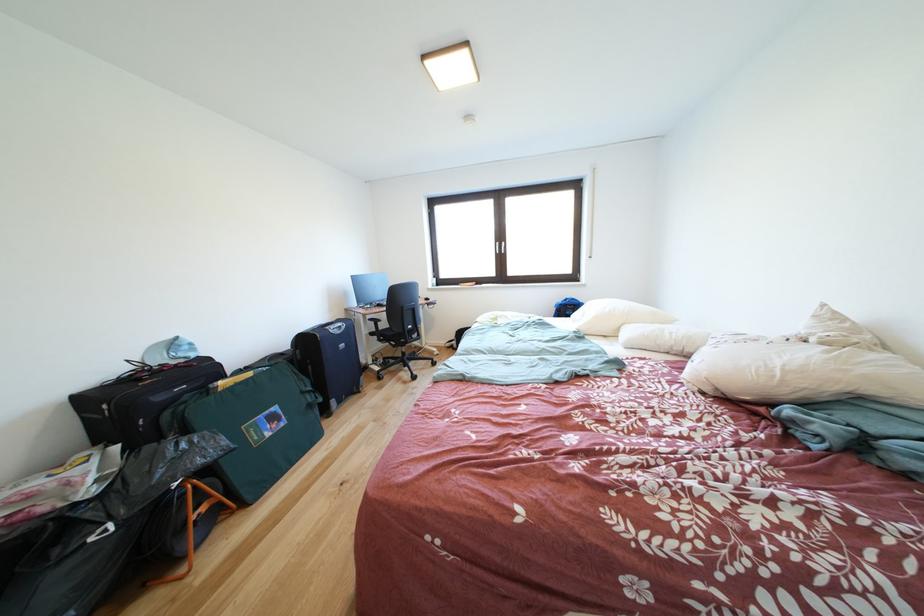
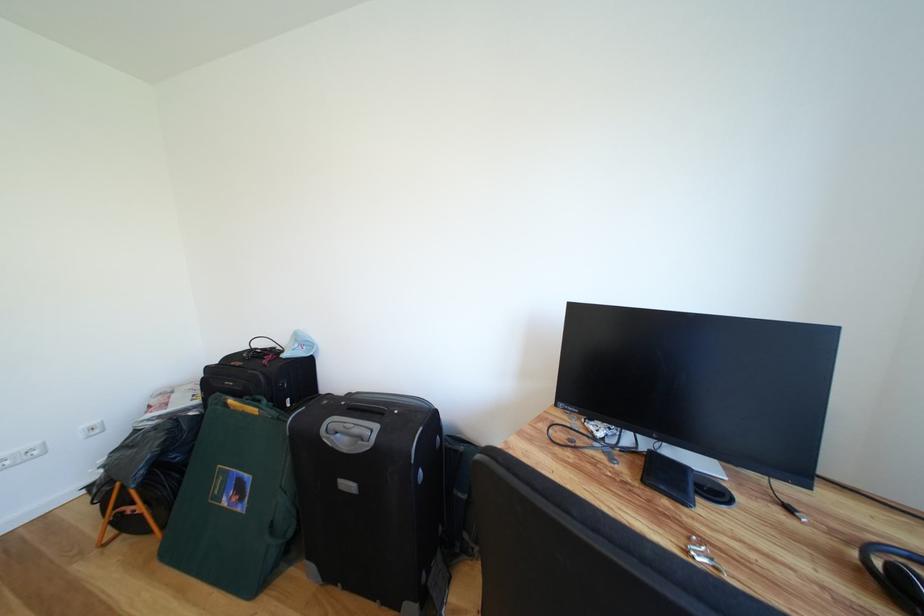
The point at (347, 337) is marked in the first image. Where is the corresponding point in the second image?

(353, 455)